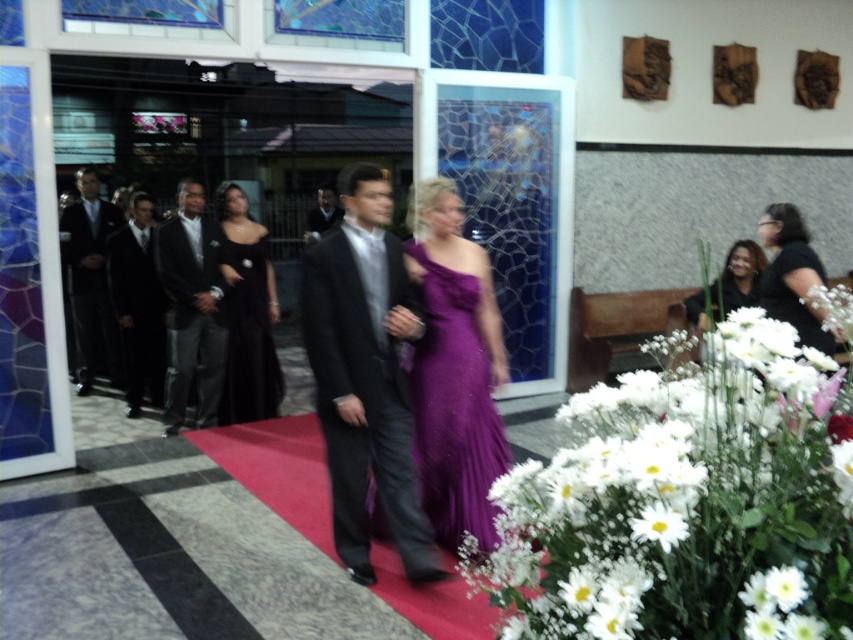
You are a photographer at the event and need to position yourself to capture both the black satin dress at center and the black matte dress at lower right in the same frame. Given their sizes, which dress will require you to stand closer to ensure it fits in the camera frame?

The black satin dress at center has a lesser width compared to the black matte dress at lower right. To ensure both fit in the frame, you should position yourself closer to the black satin dress at center since it is narrower and might need a tighter focus, while the wider black matte dress at lower right can be accommodated from a slightly farther distance.

You are standing at the entrance of the venue and see two points marked in the image. Which point is closer to you, point [242,253] or point [780,262]?

Point [242,253] is closer to you because it is further to the viewer than point [780,262].